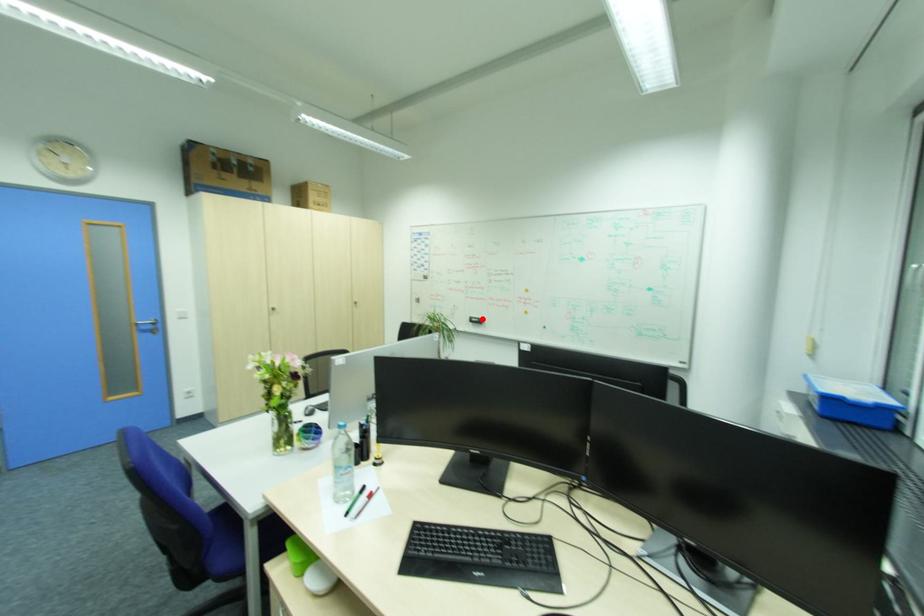
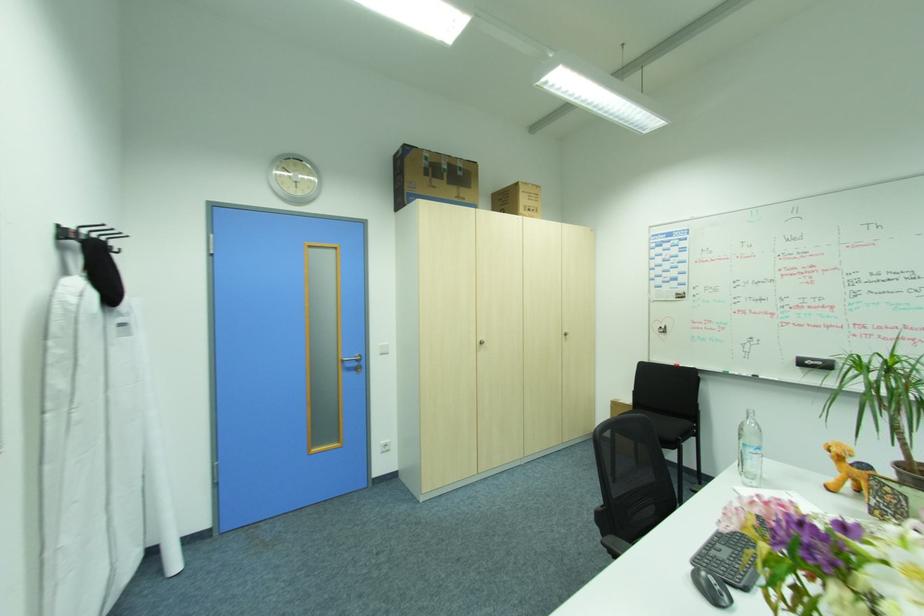
Find the pixel in the second image that matches the highlighted location in the first image.

(824, 363)